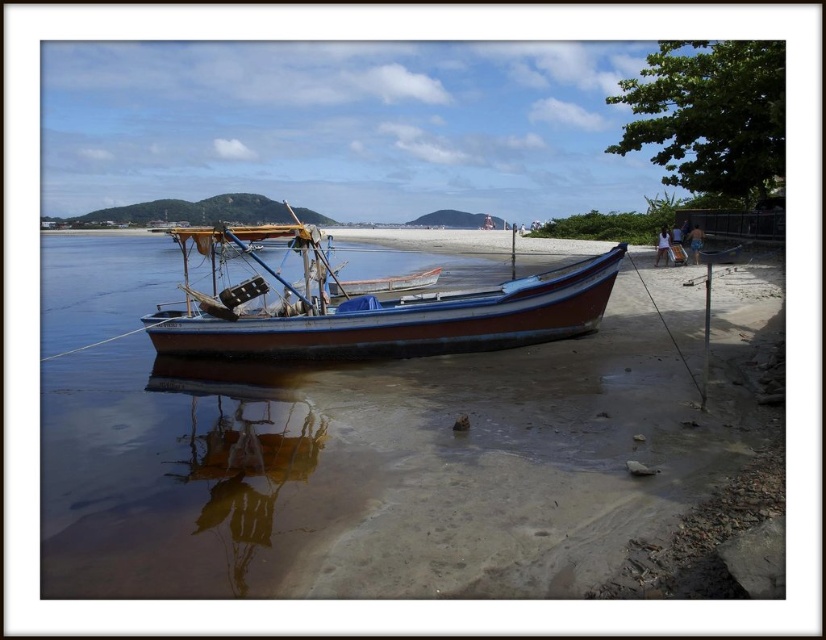
You are standing on the beach and want to take a photo of the brown reflective water at center. If your camera can focus on objects up to 3 meters away, will you need to move closer to capture a clear image?

The brown reflective water at center is 3.54 meters away from the camera. Since the camera can only focus up to 3 meters, you need to move closer to ensure the image is clear.

You are a photographer standing on the beach and want to capture the wooden boat at center in your shot. However, you notice the brown reflective water at center might be blocking part of the boat. Is the water in front of or behind the boat?

The brown reflective water at center is positioned under the wooden boat at center, so the water is behind the boat and not blocking it.

You are a photographer planning to capture the wooden boat at center and the brown reflective water at center in a single frame. Based on the scene, can you fit both objects in your camera view if the boat takes up half the width of your frame?

The brown reflective water at center is wider than the wooden boat at center. Since the boat takes up half the width, there is enough space remaining to include the wider brown reflective water at center in the frame.